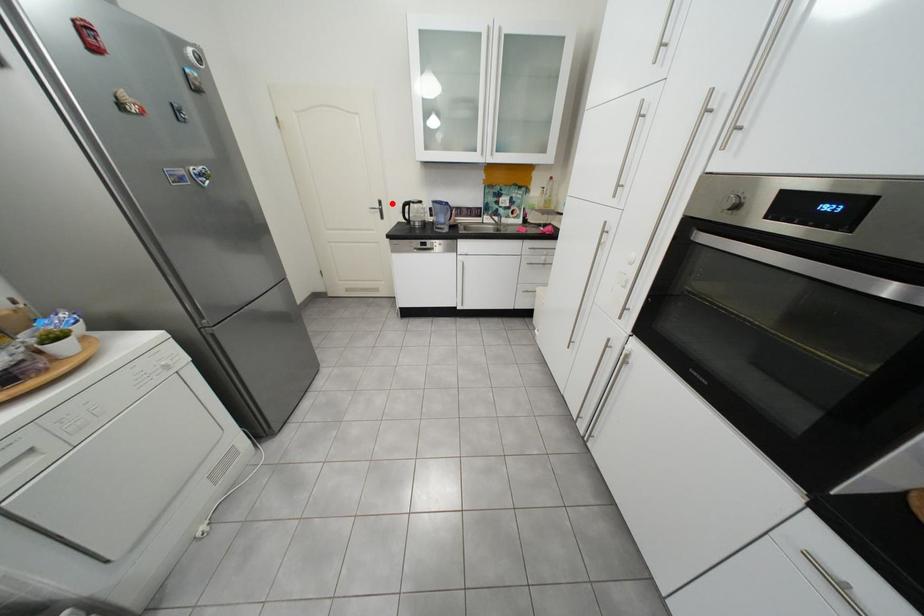
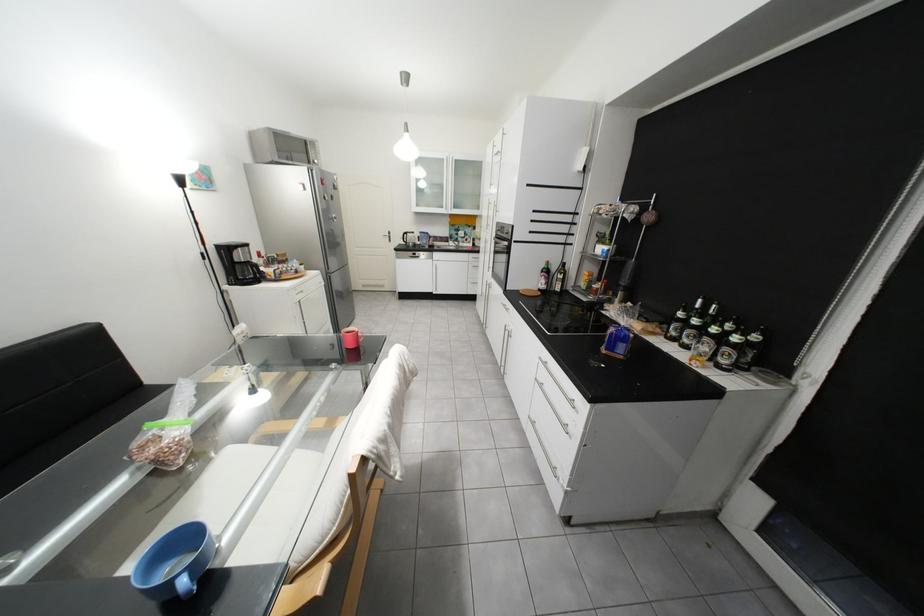
Locate, in the second image, the point that corresponds to the highlighted location in the first image.

(402, 233)